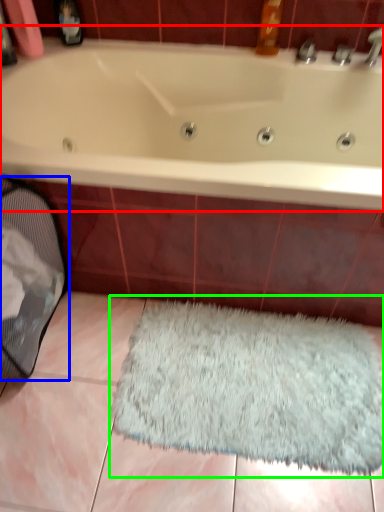
Question: Which object is the farthest from bathtub (highlighted by a red box)? Choose among these: laundry basket (highlighted by a blue box) or doormat (highlighted by a green box).

Choices:
 (A) laundry basket
 (B) doormat

Answer: (B)